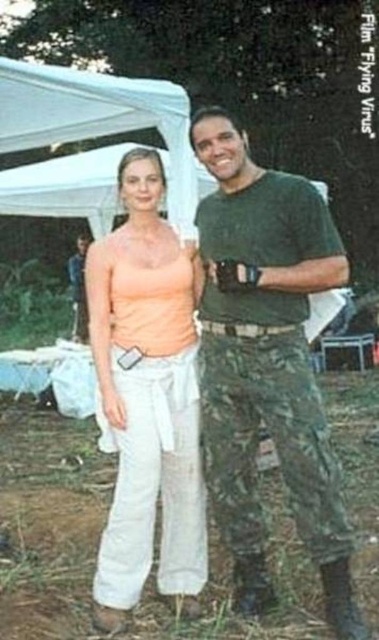
Does green camouflage pants at right have a greater width compared to matte peach tank top at center?

Yes, green camouflage pants at right is wider than matte peach tank top at center.

Is point (256, 307) closer to viewer compared to point (131, 236)?

Yes, it is in front of point (131, 236).

At what (x,y) coordinates should I click in order to perform the action: click on green camouflage pants at right. Please return your answer as a coordinate pair (x, y). Looking at the image, I should click on (266, 362).

At what (x,y) coordinates should I click in order to perform the action: click on green camouflage pants at right. Please return your answer as a coordinate pair (x, y). Looking at the image, I should click on (266, 362).